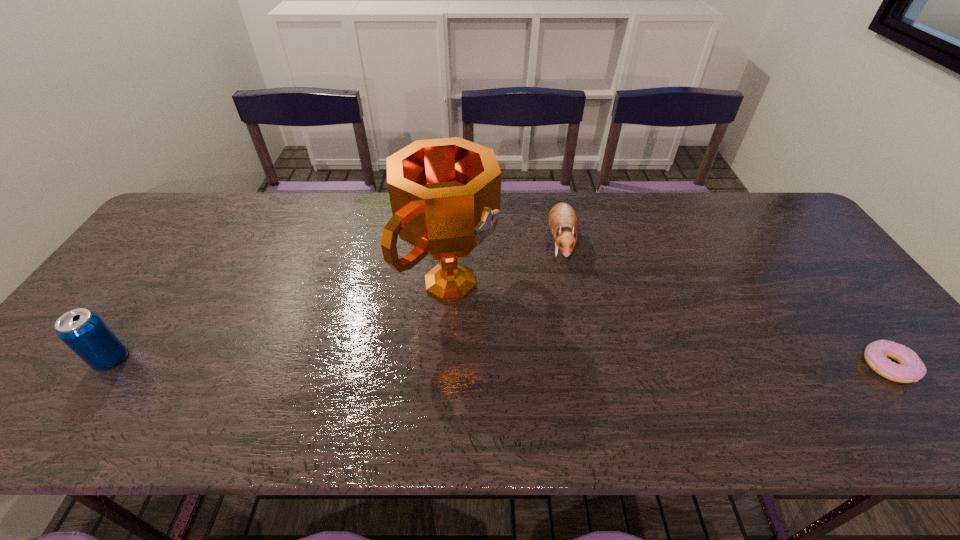
Locate an element on the screen. This screenshot has height=540, width=960. vacant space on the desktop that is between the leftmost object and the rightmost object and is positioned on the side of the tallest object with the star emblem is located at coordinates (602, 363).

You are a GUI agent. You are given a task and a screenshot of the screen. Output one action in this format:
    pyautogui.click(x=<x>, y=<y>)
    Task: Click on the vacant space on the desktop that is between the second tallest object and the rightmost object and is positioned at the face of the hamster
    This screenshot has height=540, width=960.
    Given the screenshot: What is the action you would take?
    pyautogui.click(x=555, y=363)